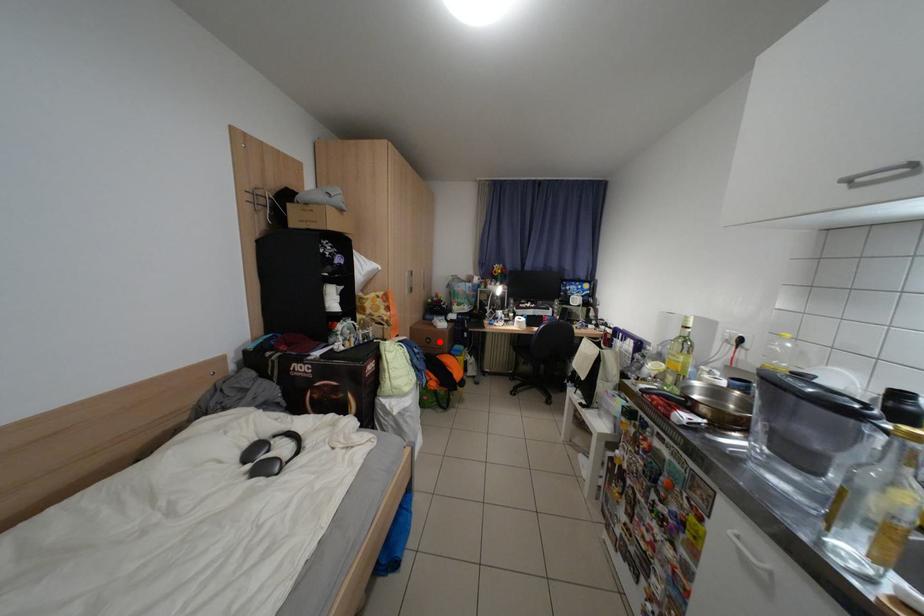
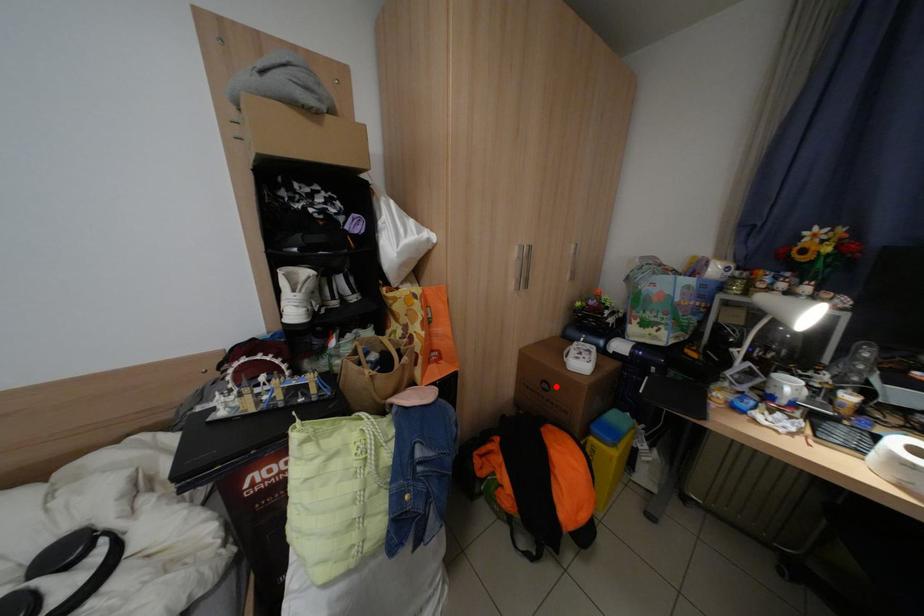
I am providing you with two images of the same scene from different viewpoints. A red point is marked on the first image and another point is marked on the second image. Is the red point in image1 aligned with the point shown in image2?

Yes